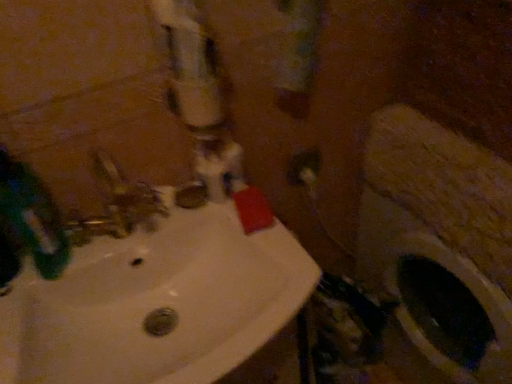
Question: Should I look upward or downward to see matte white outlet at center?

Choices:
 (A) up
 (B) down

Answer: (A)

Question: Are matte white outlet at center and green matte toothbrush at left located far from each other?

Choices:
 (A) no
 (B) yes

Answer: (A)

Question: Is green matte toothbrush at left at the back of matte white outlet at center?

Choices:
 (A) yes
 (B) no

Answer: (B)

Question: Considering the relative positions of matte white outlet at center and green matte toothbrush at left in the image provided, is matte white outlet at center in front of green matte toothbrush at left?

Choices:
 (A) yes
 (B) no

Answer: (B)

Question: Does matte white outlet at center come behind green matte toothbrush at left?

Choices:
 (A) yes
 (B) no

Answer: (A)

Question: Is matte white outlet at center at the left side of green matte toothbrush at left?

Choices:
 (A) yes
 (B) no

Answer: (B)

Question: Does matte white outlet at center have a lesser width compared to green matte toothbrush at left?

Choices:
 (A) no
 (B) yes

Answer: (B)

Question: Can you confirm if white glossy sink at center is positioned to the right of white glossy water pipe at upper center?

Choices:
 (A) yes
 (B) no

Answer: (B)

Question: Is white glossy sink at center completely or partially outside of white glossy water pipe at upper center?

Choices:
 (A) yes
 (B) no

Answer: (A)

Question: Is white glossy sink at center behind white glossy water pipe at upper center?

Choices:
 (A) no
 (B) yes

Answer: (A)

Question: Does white glossy sink at center have a larger size compared to white glossy water pipe at upper center?

Choices:
 (A) yes
 (B) no

Answer: (A)

Question: From the image's perspective, is white glossy sink at center above white glossy water pipe at upper center?

Choices:
 (A) no
 (B) yes

Answer: (A)

Question: From a real-world perspective, is white glossy sink at center located higher than white glossy water pipe at upper center?

Choices:
 (A) no
 (B) yes

Answer: (A)

Question: Can you confirm if white glossy water pipe at upper center is shorter than green matte toothbrush at left?

Choices:
 (A) yes
 (B) no

Answer: (B)